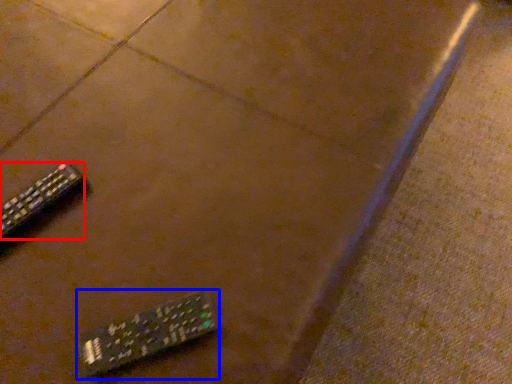
Question: Which of the following is the farthest to the observer, remote control (highlighted by a red box) or remote control (highlighted by a blue box)?

Choices:
 (A) remote control
 (B) remote control

Answer: (A)